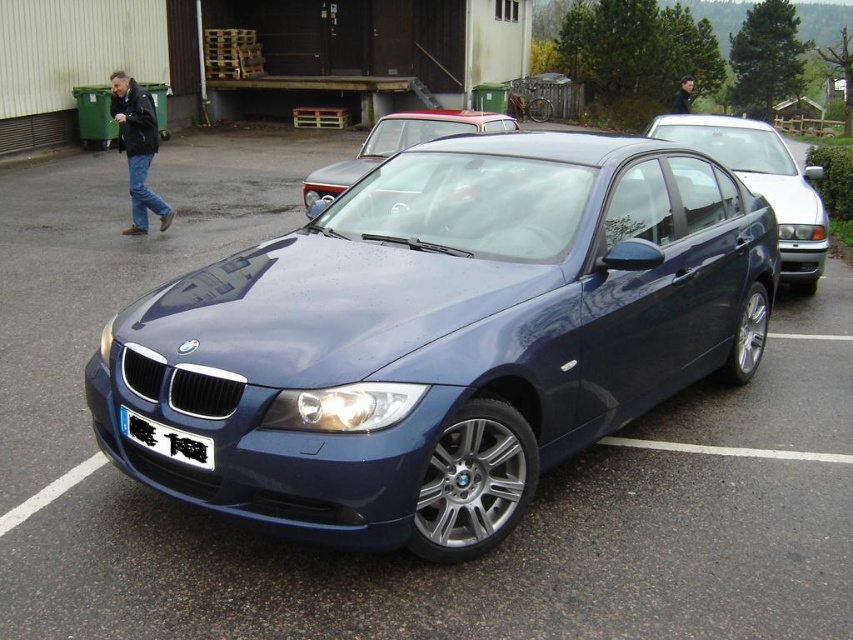
Question: Among these objects, which one is farthest from the camera?

Choices:
 (A) white plastic license plate at center
 (B) satin blue car at center

Answer: (A)

Question: Does satin blue sedan at right appear on the left side of white plastic license plate at center?

Choices:
 (A) yes
 (B) no

Answer: (B)

Question: Which point is closer to the camera?

Choices:
 (A) (799, 228)
 (B) (131, 406)
 (C) (131, 440)

Answer: (B)

Question: Can you confirm if satin blue sedan at right is thinner than white plastic license plate at center?

Choices:
 (A) yes
 (B) no

Answer: (B)

Question: Does satin blue car at center appear on the left side of matte black car at left?

Choices:
 (A) no
 (B) yes

Answer: (A)

Question: Which point is farther to the camera?

Choices:
 (A) matte black car at left
 (B) glossy metallic car at center
 (C) white plastic license plate at center

Answer: (A)